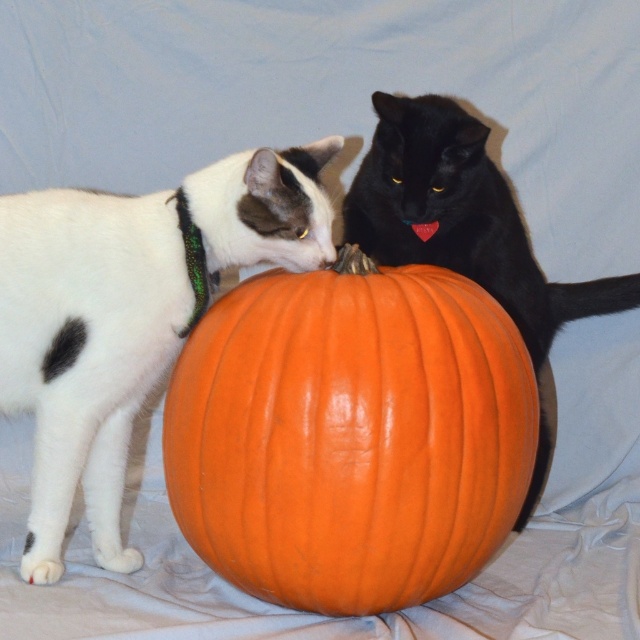
You are a photographer setting up a camera to capture both the white matte fur cat at left and the black glossy cat at center. Since you want to ensure both cats fit in the frame, which cat requires more careful positioning due to its size?

The white matte fur cat at left has a lesser width compared to the black glossy cat at center, so the larger black glossy cat at center requires more careful positioning to ensure it fits within the camera frame.